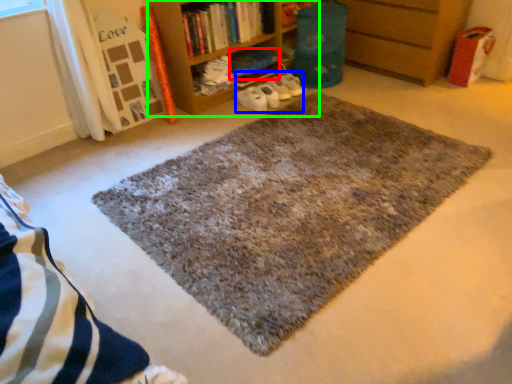
Question: Based on their relative distances, which object is farther from book (highlighted by a red box)? Choose from shoe (highlighted by a blue box) and bookcase (highlighted by a green box).

Choices:
 (A) shoe
 (B) bookcase

Answer: (B)